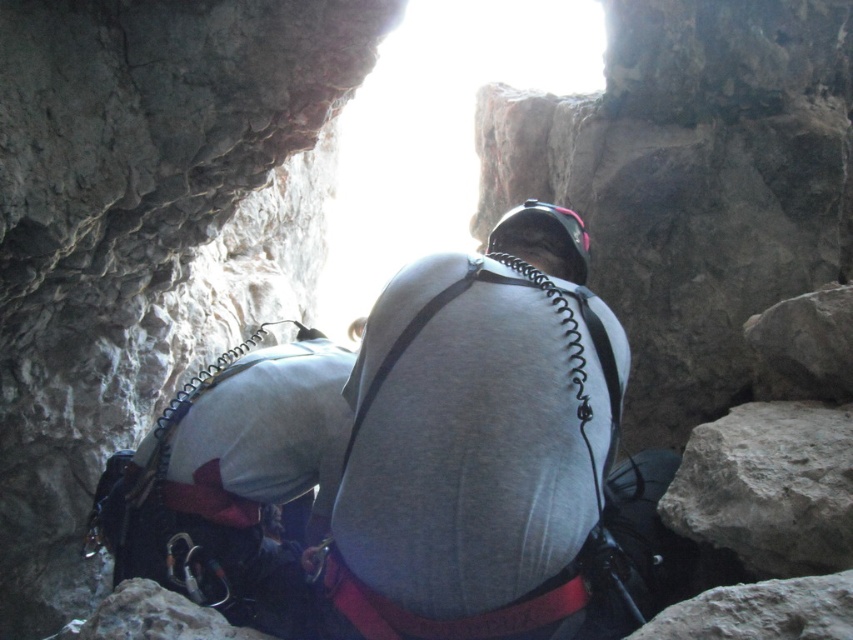
Question: Is gray rock at lower right behind rough textured rock at lower right?

Choices:
 (A) yes
 (B) no

Answer: (A)

Question: Does matte gray harness at center have a greater width compared to smooth rock at lower left?

Choices:
 (A) no
 (B) yes

Answer: (B)

Question: Considering the real-world distances, which object is farthest from the matte gray harness at center?

Choices:
 (A) smooth rock at lower left
 (B) smooth gray rock at center
 (C) rough textured rock at lower right

Answer: (C)

Question: Which object is farther from the camera taking this photo?

Choices:
 (A) smooth gray rock at center
 (B) matte gray harness at center
 (C) gray matte shirt at center
 (D) gray rock at lower right

Answer: (A)

Question: Is gray rock at lower right wider than smooth rock at lower left?

Choices:
 (A) yes
 (B) no

Answer: (A)

Question: Among these points, which one is farthest from the camera?

Choices:
 (A) (743, 600)
 (B) (212, 627)
 (C) (173, 396)

Answer: (C)